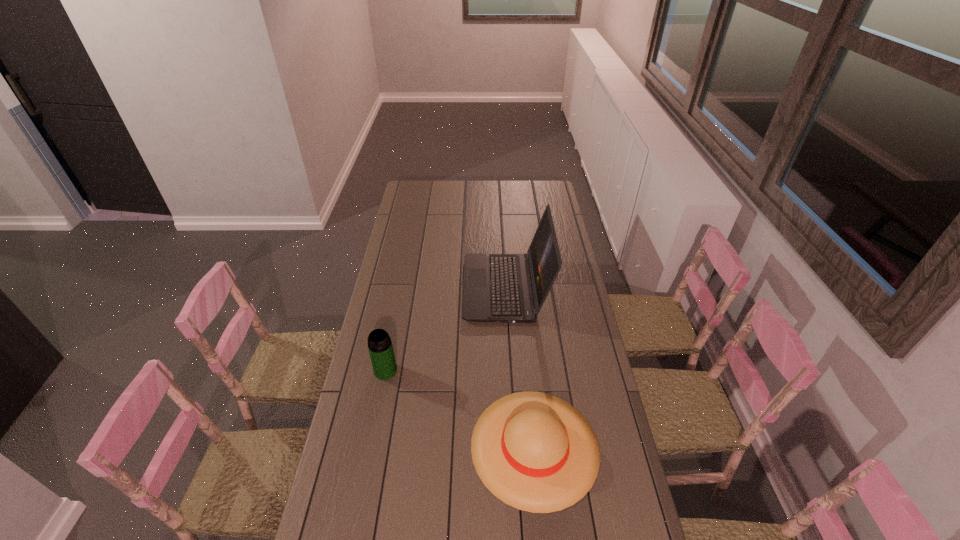
At what (x,y) coordinates should I click in order to perform the action: click on vacant space located 0.260m on the left of the sombrero. Please return your answer as a coordinate pair (x, y). The width and height of the screenshot is (960, 540). Looking at the image, I should click on (390, 446).

Where is `object that is positioned at the left edge`? The height and width of the screenshot is (540, 960). object that is positioned at the left edge is located at coordinates (380, 347).

This screenshot has width=960, height=540. I want to click on laptop_computer that is positioned at the right edge, so click(512, 288).

Locate an element on the screen. The width and height of the screenshot is (960, 540). sombrero located at the right edge is located at coordinates point(534,451).

Image resolution: width=960 pixels, height=540 pixels. What are the coordinates of `vacant position at the far edge of the desktop` in the screenshot? It's located at (457, 196).

The width and height of the screenshot is (960, 540). Identify the location of vacant space at the left edge of the desktop. (426, 213).

You are a GUI agent. You are given a task and a screenshot of the screen. Output one action in this format:
    pyautogui.click(x=<x>, y=<y>)
    Task: Click on the vacant space at the right edge of the desktop
    
    Given the screenshot: What is the action you would take?
    pyautogui.click(x=550, y=292)

Image resolution: width=960 pixels, height=540 pixels. Find the location of `free space at the far left corner of the desktop`. free space at the far left corner of the desktop is located at coordinates (408, 193).

Find the location of a particular element. vacant area at the far right corner of the desktop is located at coordinates (540, 200).

Where is `unoccupied area between the second tallest object and the tallest object`? The width and height of the screenshot is (960, 540). unoccupied area between the second tallest object and the tallest object is located at coordinates (445, 330).